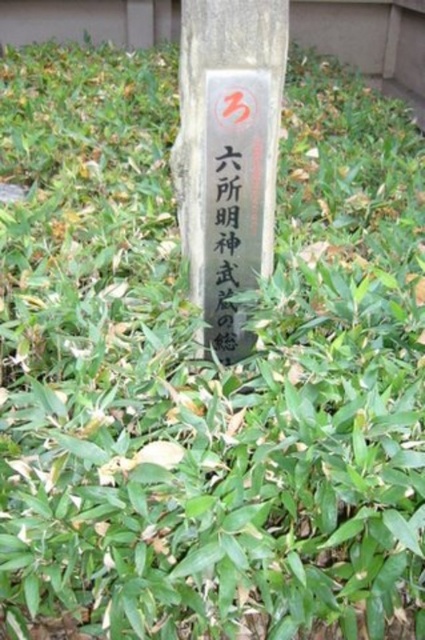
Which is more to the right, black stone sign at center or green paper at center?

Positioned to the right is green paper at center.

Is black stone sign at center smaller than green paper at center?

Actually, black stone sign at center might be larger than green paper at center.

Who is more distant from viewer, (198,72) or (224,356)?

The point (224,356) is more distant.

Where is `black stone sign at center`? black stone sign at center is located at coordinates (229, 154).